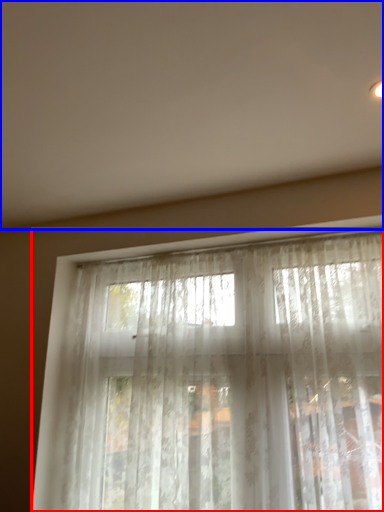
Question: Which object is further to the camera taking this photo, curtain (highlighted by a red box) or backdrop (highlighted by a blue box)?

Choices:
 (A) curtain
 (B) backdrop

Answer: (A)